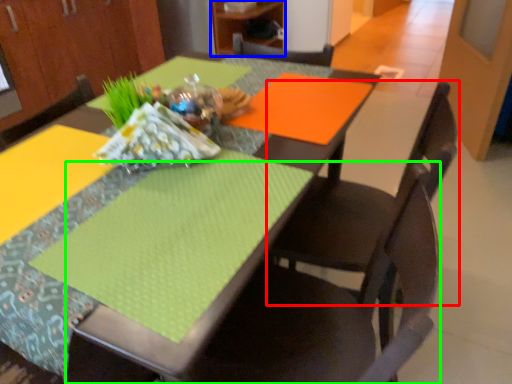
Question: Which object is the farthest from chair (highlighted by a red box)? Choose among these: cabinetry (highlighted by a blue box) or chair (highlighted by a green box).

Choices:
 (A) cabinetry
 (B) chair

Answer: (A)